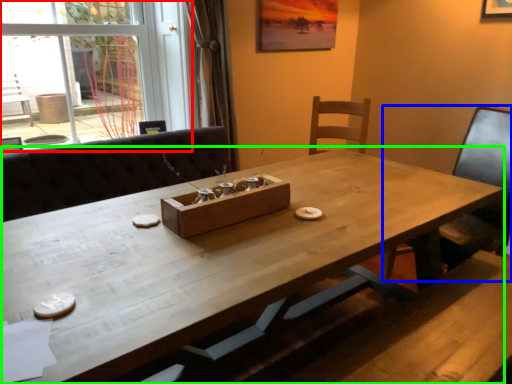
Question: Which object is the closest to the glass door (highlighted by a red box)? Choose among these: chair (highlighted by a blue box) or table (highlighted by a green box).

Choices:
 (A) chair
 (B) table

Answer: (B)